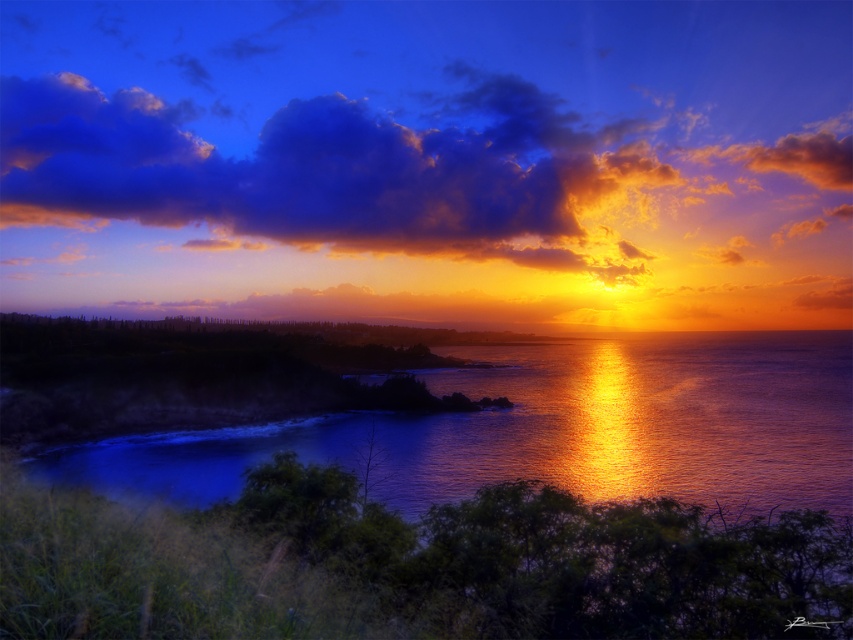
Question: Does cloudy sky at upper center lie behind shiny reflective water at center?

Choices:
 (A) no
 (B) yes

Answer: (B)

Question: Which object is farther from the camera taking this photo?

Choices:
 (A) shiny reflective water at center
 (B) cloudy sky at upper center

Answer: (B)

Question: Which point is farther to the camera?

Choices:
 (A) cloudy sky at upper center
 (B) shiny reflective water at center

Answer: (A)

Question: Can you confirm if cloudy sky at upper center is smaller than shiny reflective water at center?

Choices:
 (A) no
 (B) yes

Answer: (A)

Question: Is the position of cloudy sky at upper center more distant than that of shiny reflective water at center?

Choices:
 (A) no
 (B) yes

Answer: (B)

Question: Which point is farther from the camera taking this photo?

Choices:
 (A) (477, 236)
 (B) (730, 499)

Answer: (A)